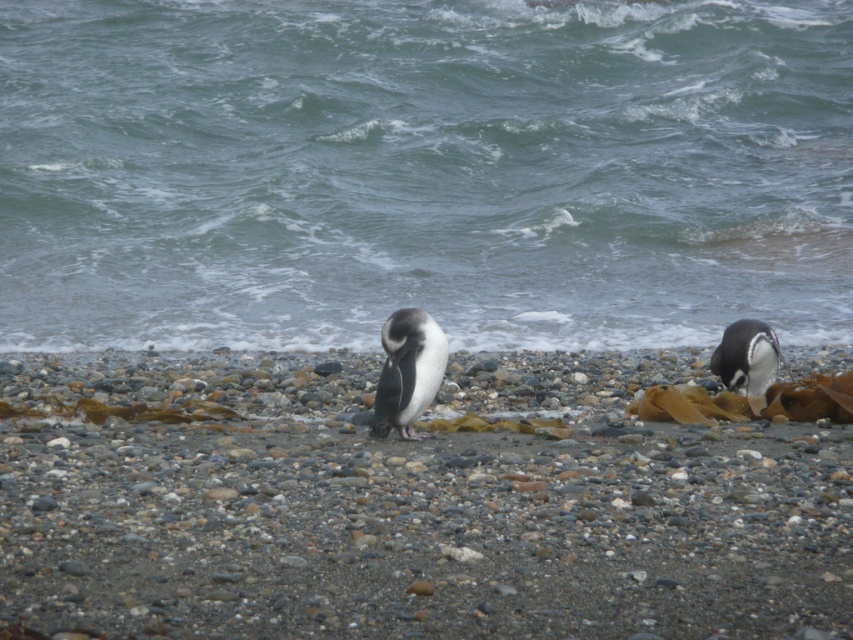
Consider the image. You are a photographer standing at the edge of the beach. You want to take a photo of the smooth pebble at center and the black and white feathers at center. Which object will appear larger in your photo?

The smooth pebble at center will appear larger in the photo because it is closer to the viewer than the black and white feathers at center.